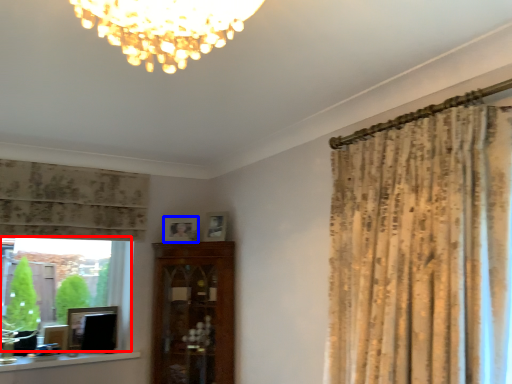
Question: Among these objects, which one is nearest to the camera, bay window (highlighted by a red box) or picture frame (highlighted by a blue box)?

Choices:
 (A) bay window
 (B) picture frame

Answer: (A)